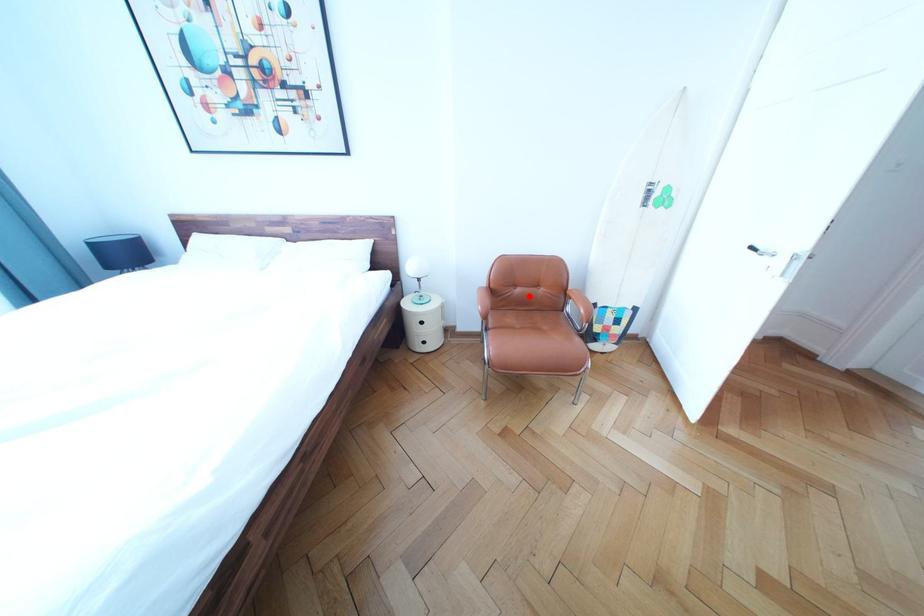
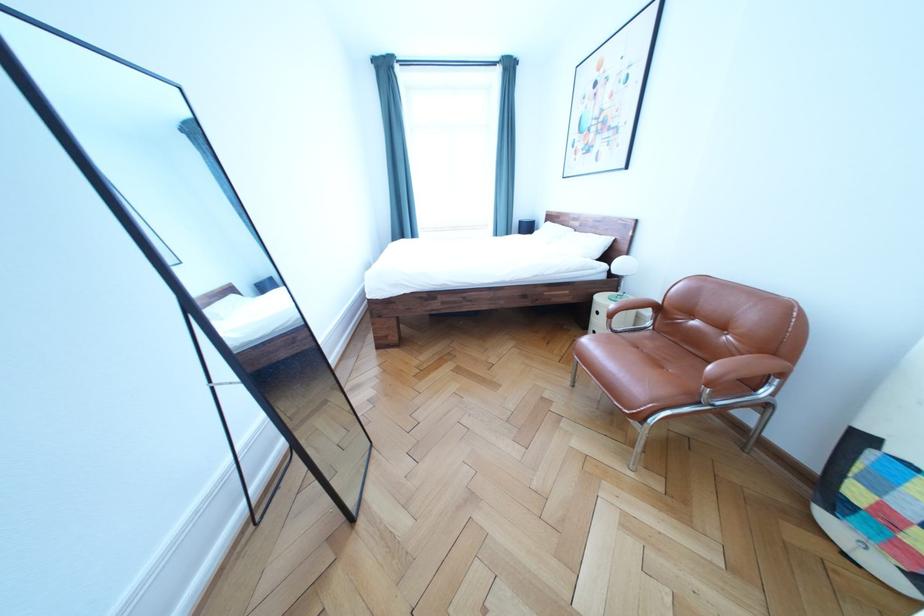
Locate, in the second image, the point that corresponds to the highlighted location in the first image.

(706, 329)